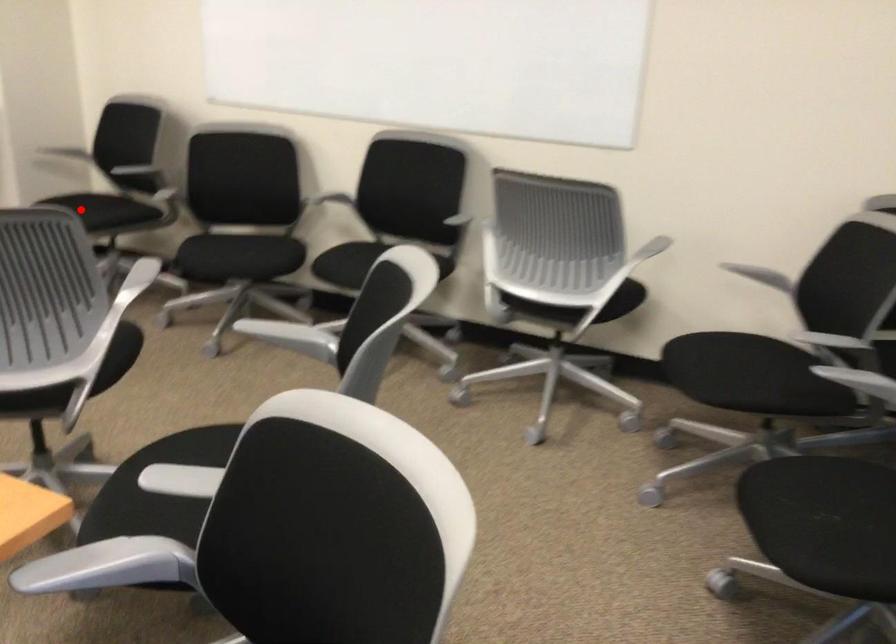
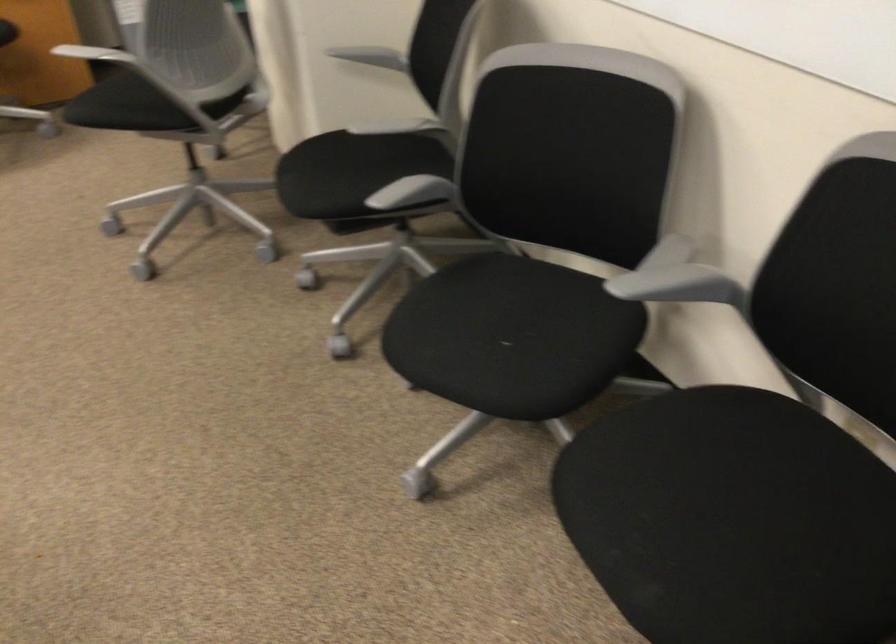
Locate, in the second image, the point that corresponds to the highlighted location in the first image.

(319, 176)